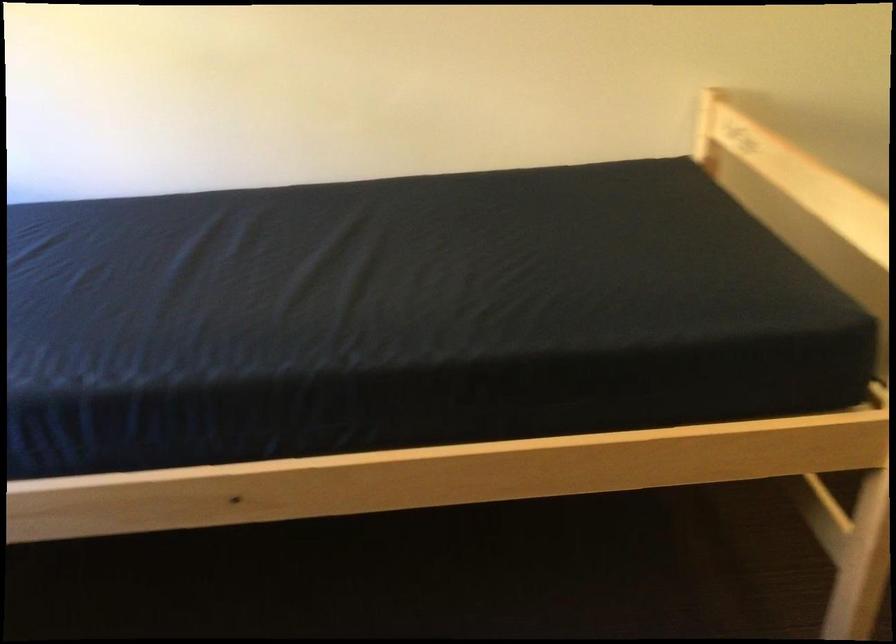
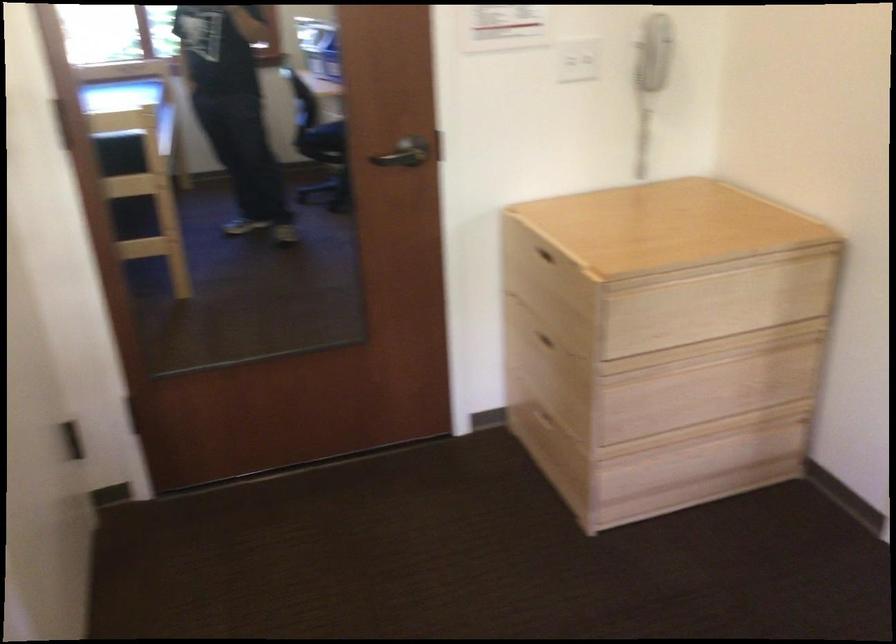
First-person continuous shooting, in which direction is the camera rotating?

The camera rotated toward right-down.